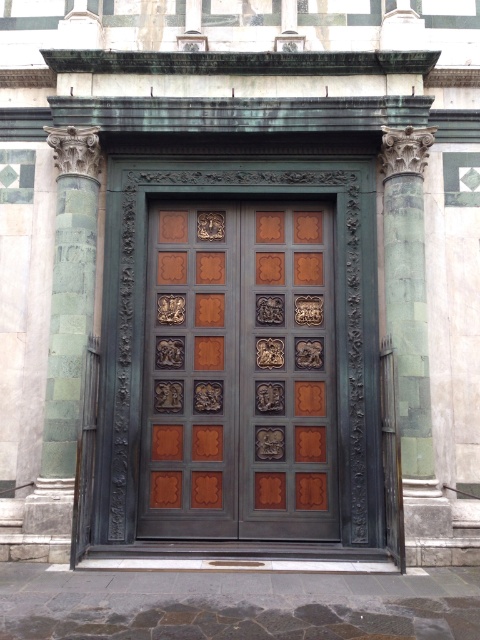
You are standing at the entrance of the grand door and want to take a photo of the point at coordinates point (x=96, y=240). If your camera can focus on objects up to 12 meters away, will you be able to capture the point clearly?

The point at coordinates point (x=96, y=240) is 11.55 meters away from the camera. Since the camera can focus up to 12 meters, you can capture the point clearly.

You are a visitor approaching the entrance. You see the polished bronze door at center and the green marble column at right. Which object is closer to your left side as you face the entrance?

The polished bronze door at center is to the left of the green marble column at right, so when facing the entrance, the polished bronze door at center would be closer to your left side.